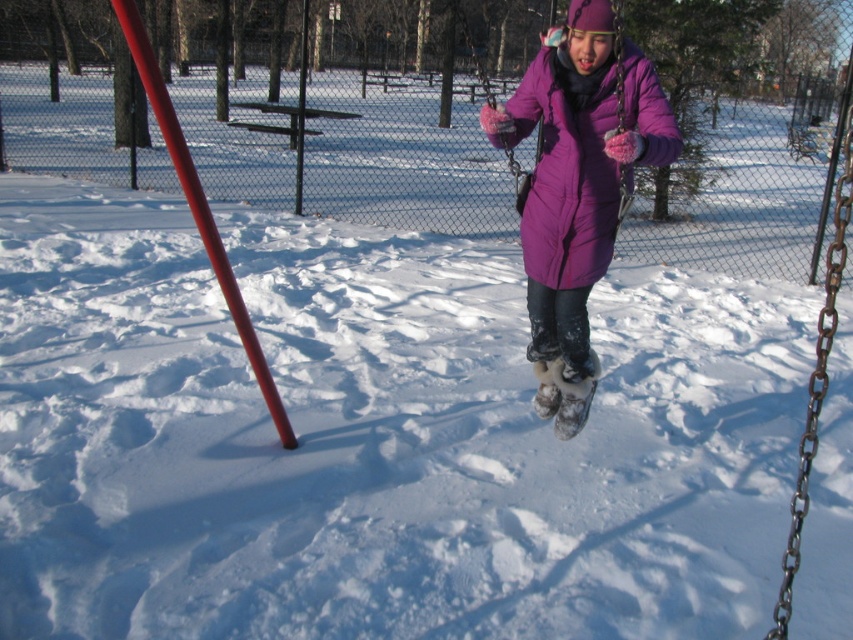
Question: Which of the following is the farthest from the observer?

Choices:
 (A) (550, 365)
 (B) (238, 314)

Answer: (A)

Question: Which of the following is the closest to the observer?

Choices:
 (A) smooth glossy pole at left
 (B) purple down jacket at center

Answer: (A)

Question: Is purple down jacket at center wider than smooth glossy pole at left?

Choices:
 (A) yes
 (B) no

Answer: (A)

Question: Does purple down jacket at center appear on the left side of smooth glossy pole at left?

Choices:
 (A) no
 (B) yes

Answer: (A)

Question: Which object appears farthest from the camera in this image?

Choices:
 (A) smooth glossy pole at left
 (B) purple down jacket at center

Answer: (B)

Question: Observing the image, what is the correct spatial positioning of purple down jacket at center in reference to smooth glossy pole at left?

Choices:
 (A) below
 (B) above

Answer: (A)